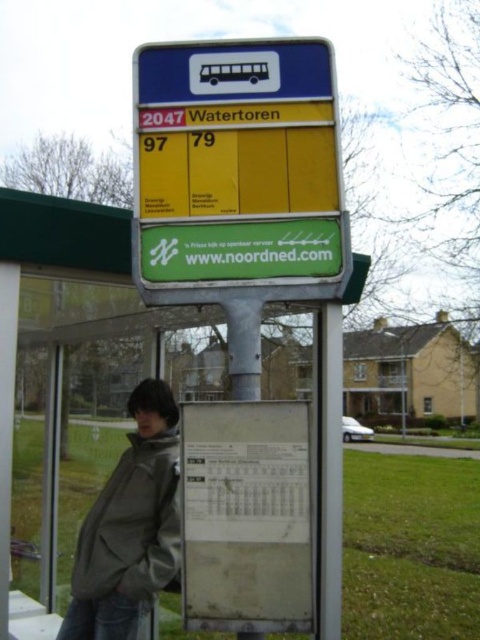
Based on the photo, is metallic green sign at center to the left of gray matte jacket at lower left from the viewer's perspective?

Correct, you'll find metallic green sign at center to the left of gray matte jacket at lower left.

Is metallic green sign at center bigger than gray matte jacket at lower left?

Correct, metallic green sign at center is larger in size than gray matte jacket at lower left.

Does point (36, 624) come in front of point (85, 572)?

No, it is not.

The width and height of the screenshot is (480, 640). I want to click on metallic green sign at center, so click(61, 378).